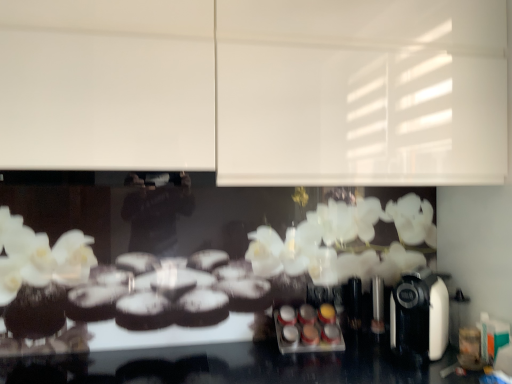
Question: Would you say metallic silver spice rack at center is to the left or to the right of white matte cabinet at upper center in the picture?

Choices:
 (A) right
 (B) left

Answer: (A)

Question: Is metallic silver spice rack at center taller or shorter than white matte cabinet at upper center?

Choices:
 (A) tall
 (B) short

Answer: (B)

Question: Which object is the closest to the white matte cabinet at upper center?

Choices:
 (A) black plastic coffee machine at right
 (B) metallic silver spice rack at center

Answer: (A)

Question: Which object is the closest to the metallic silver spice rack at center?

Choices:
 (A) white matte cabinet at upper center
 (B) black plastic coffee machine at right

Answer: (B)